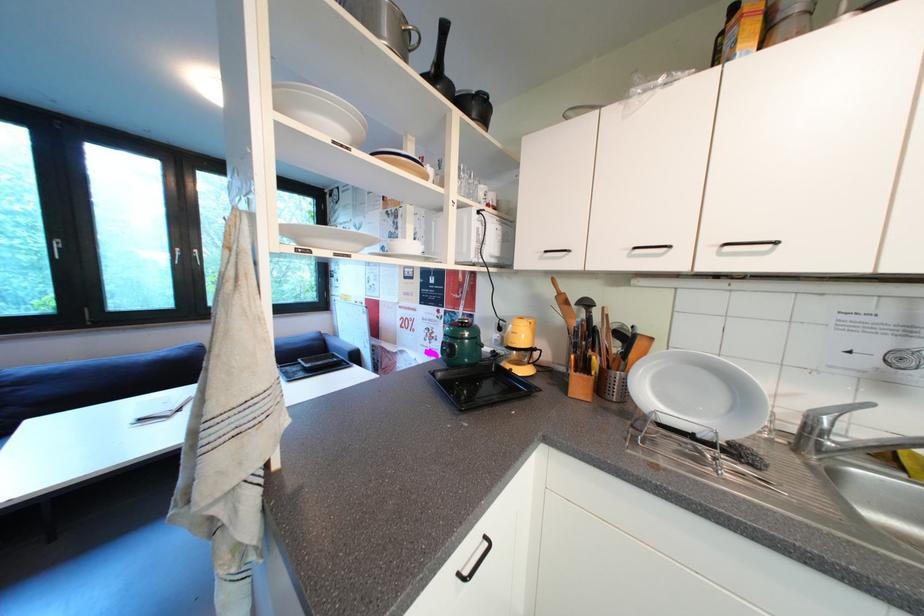
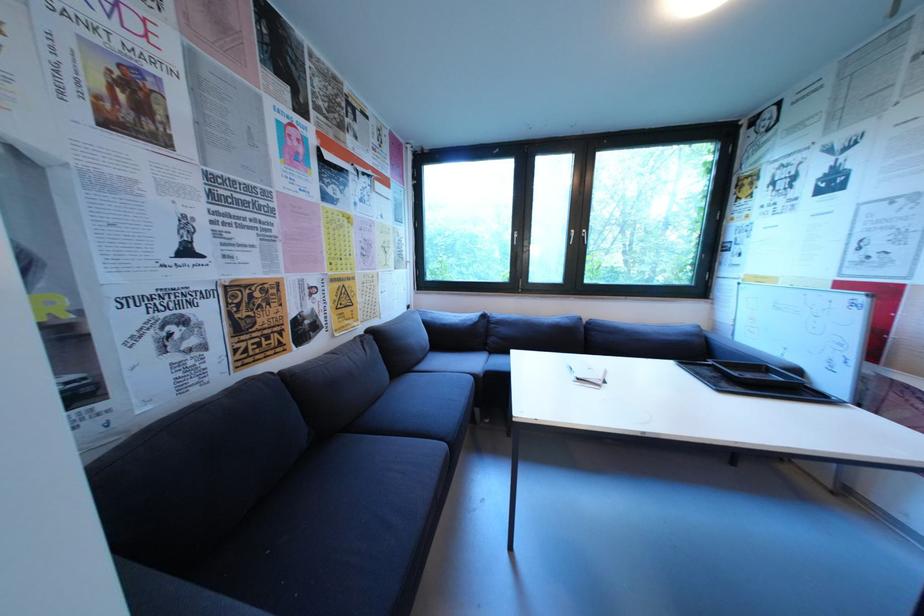
Question: The first image is from the beginning of the video and the second image is from the end. How did the camera likely rotate when shooting the video?

Choices:
 (A) Left
 (B) Right
 (C) Up
 (D) Down

Answer: (A)